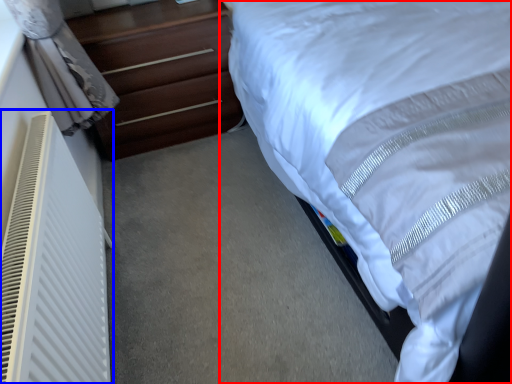
Question: Which object appears closest to the camera in this image, bed (highlighted by a red box) or air conditioner (highlighted by a blue box)?

Choices:
 (A) bed
 (B) air conditioner

Answer: (A)